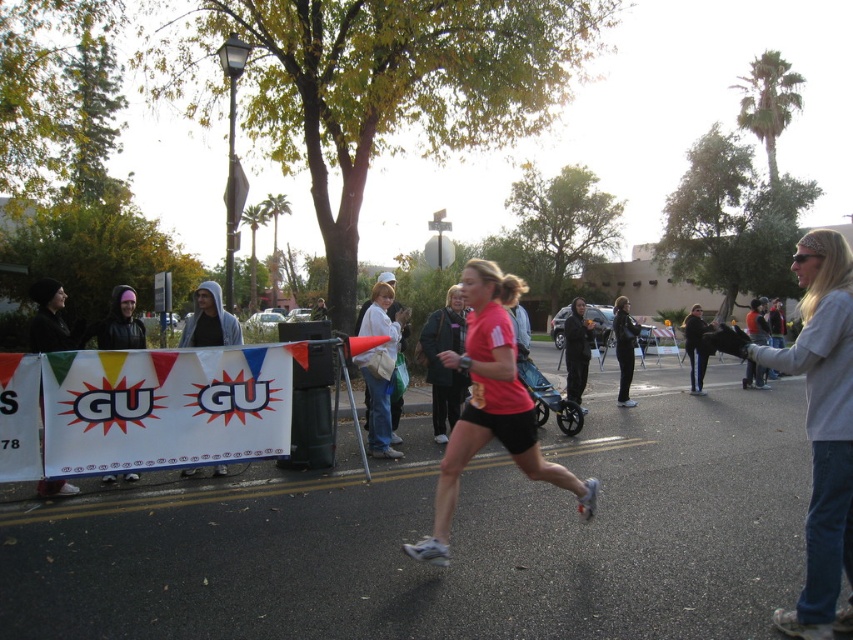
Can you confirm if pink matte running shirt at center is positioned to the left of gray hoodie at center?

Incorrect, pink matte running shirt at center is not on the left side of gray hoodie at center.

Does pink matte running shirt at center come behind gray hoodie at center?

No, pink matte running shirt at center is in front of gray hoodie at center.

Between point (502, 384) and point (200, 310), which one is positioned in front?

Point (502, 384) is in front.

You are a GUI agent. You are given a task and a screenshot of the screen. Output one action in this format:
    pyautogui.click(x=<x>, y=<y>)
    Task: Click on the pink matte running shirt at center
    The width and height of the screenshot is (853, 640).
    Given the screenshot: What is the action you would take?
    pyautogui.click(x=491, y=404)

Does pink matte running shirt at center have a larger size compared to black leather jacket at center?

Actually, pink matte running shirt at center might be smaller than black leather jacket at center.

Can you confirm if pink matte running shirt at center is smaller than black leather jacket at center?

Yes.

Does point (490, 264) come behind point (624, 316)?

That is False.

Where is `pink matte running shirt at center`? The width and height of the screenshot is (853, 640). pink matte running shirt at center is located at coordinates (491, 404).

Which is more to the right, gray hoodie at center or black leather jacket at center?

From the viewer's perspective, black leather jacket at center appears more on the right side.

Which is above, gray hoodie at center or black leather jacket at center?

gray hoodie at center is higher up.

Who is more forward, (218, 332) or (619, 300)?

Point (218, 332) is in front.

Where is `gray hoodie at center`? The image size is (853, 640). gray hoodie at center is located at coordinates (209, 321).